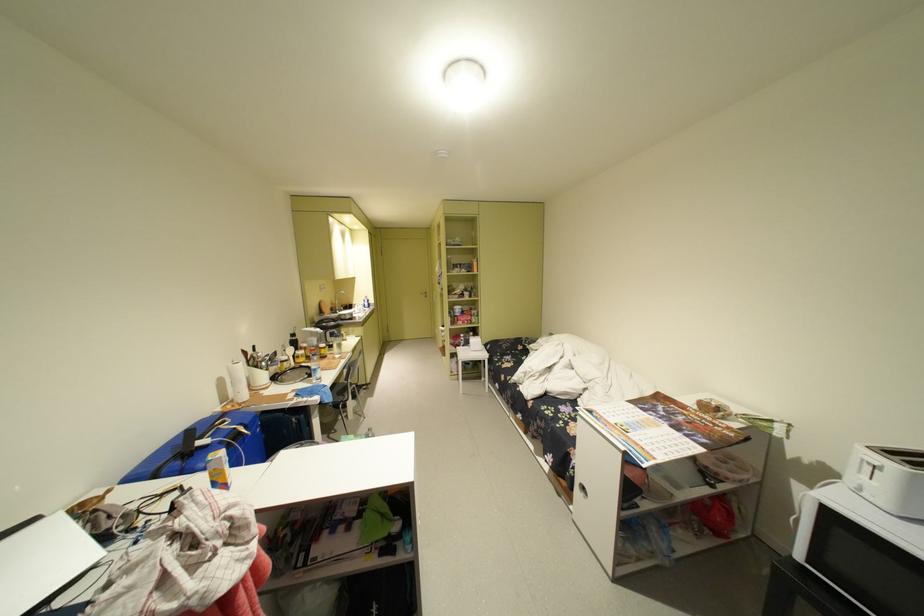
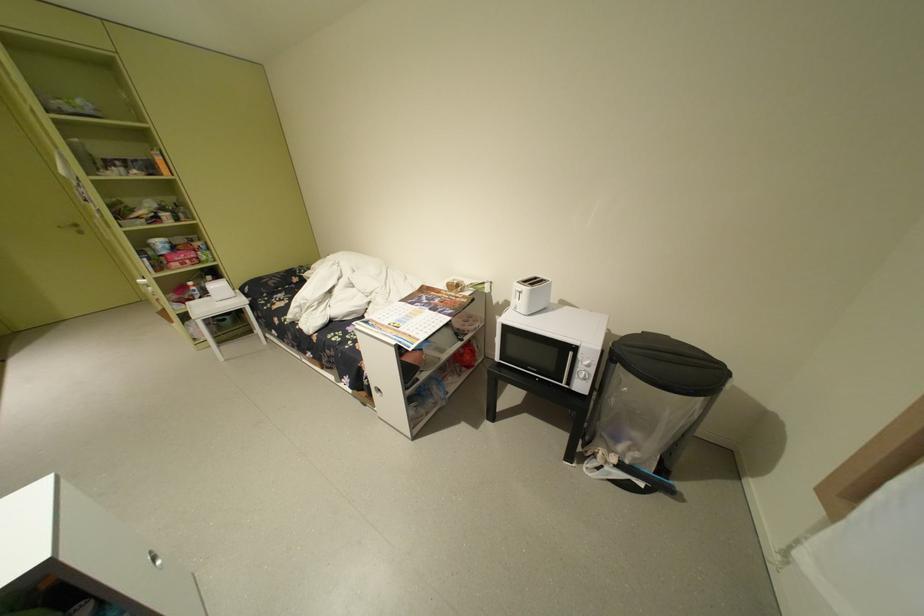
Locate, in the second image, the point that corresponds to point 870,474 in the first image.

(527, 299)